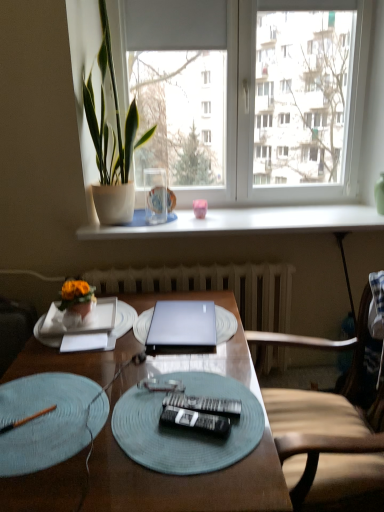
The height and width of the screenshot is (512, 384). Identify the location of free space that is in between black plastic remote control at center, which is counted as the first remote control, starting from the back, and white paper at center. (143, 377).